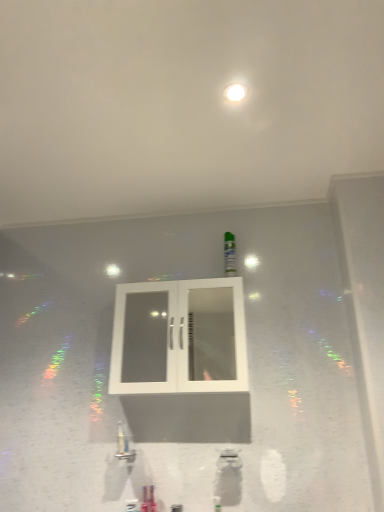
Question: Should I look upward or downward to see white matte ceiling at upper center?

Choices:
 (A) up
 (B) down

Answer: (A)

Question: From the image's perspective, would you say white glass cabinet at center is shown under green matte bottle at center?

Choices:
 (A) no
 (B) yes

Answer: (B)

Question: Are white glass cabinet at center and green matte bottle at center beside each other?

Choices:
 (A) no
 (B) yes

Answer: (A)

Question: Does white glass cabinet at center turn towards green matte bottle at center?

Choices:
 (A) yes
 (B) no

Answer: (B)

Question: Does white glass cabinet at center have a smaller size compared to green matte bottle at center?

Choices:
 (A) no
 (B) yes

Answer: (A)

Question: Considering the relative sizes of white glass cabinet at center and green matte bottle at center in the image provided, is white glass cabinet at center taller than green matte bottle at center?

Choices:
 (A) yes
 (B) no

Answer: (A)

Question: From the image's perspective, is white glass cabinet at center over green matte bottle at center?

Choices:
 (A) no
 (B) yes

Answer: (A)

Question: From the image's perspective, does green matte bottle at center appear higher than white matte ceiling at upper center?

Choices:
 (A) yes
 (B) no

Answer: (B)

Question: From a real-world perspective, is green matte bottle at center on top of white matte ceiling at upper center?

Choices:
 (A) no
 (B) yes

Answer: (A)

Question: Does green matte bottle at center turn towards white matte ceiling at upper center?

Choices:
 (A) no
 (B) yes

Answer: (A)

Question: Is green matte bottle at center next to white matte ceiling at upper center?

Choices:
 (A) yes
 (B) no

Answer: (B)

Question: Is green matte bottle at center in front of white matte ceiling at upper center?

Choices:
 (A) yes
 (B) no

Answer: (B)

Question: Does green matte bottle at center have a lesser width compared to white matte ceiling at upper center?

Choices:
 (A) yes
 (B) no

Answer: (A)

Question: Considering the relative sizes of white matte ceiling at upper center and green matte bottle at center in the image provided, is white matte ceiling at upper center smaller than green matte bottle at center?

Choices:
 (A) no
 (B) yes

Answer: (A)